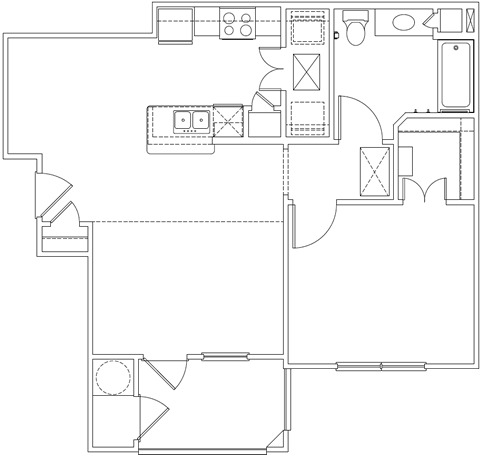
This screenshot has width=483, height=455. What are the coordinates of `toilet` in the screenshot? It's located at (354, 29).